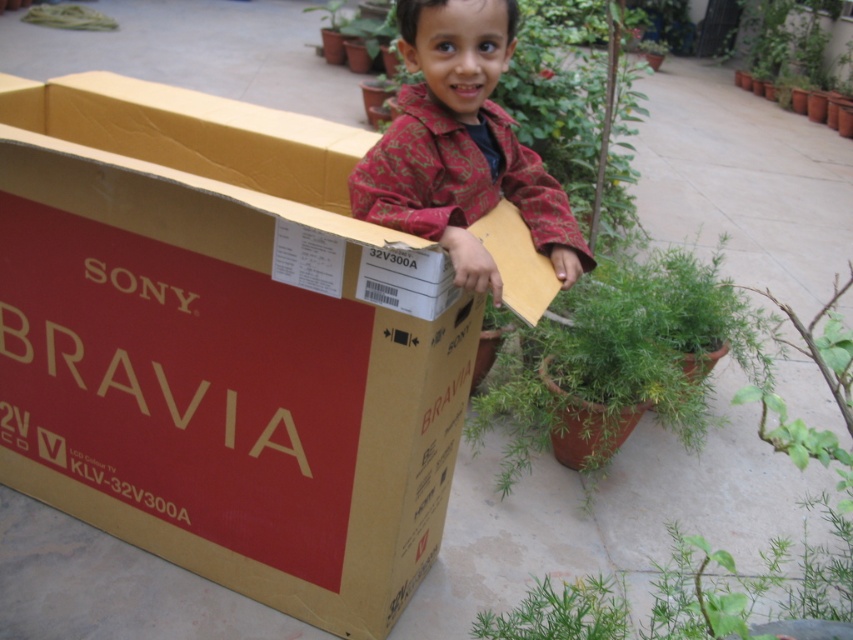
You are a photographer taking a picture of the green matte plant at center and the red paisley shirt at center. Which object should you adjust your camera focus on first if you want both to be in focus, considering their positions?

You should focus on the red paisley shirt at center first because it is closer to the camera than the green matte plant at center, ensuring both are in focus.

You are a gardener who wants to place a new plant pot between the green matte plant at center and the green leafy plant at lower center. Which plant should the new pot be closer to if you want it to be wider than both?

The new pot should be closer to the green matte plant at center because it is wider than the green leafy plant at lower center.

You are taking a photo of the red paisley shirt at center and the green matte plant at center. Which object should you focus on first if you want both to be in sharp focus?

The red paisley shirt at center is closer to the viewer than the green matte plant at center, so you should focus on the red paisley shirt at center first to ensure both are in sharp focus.